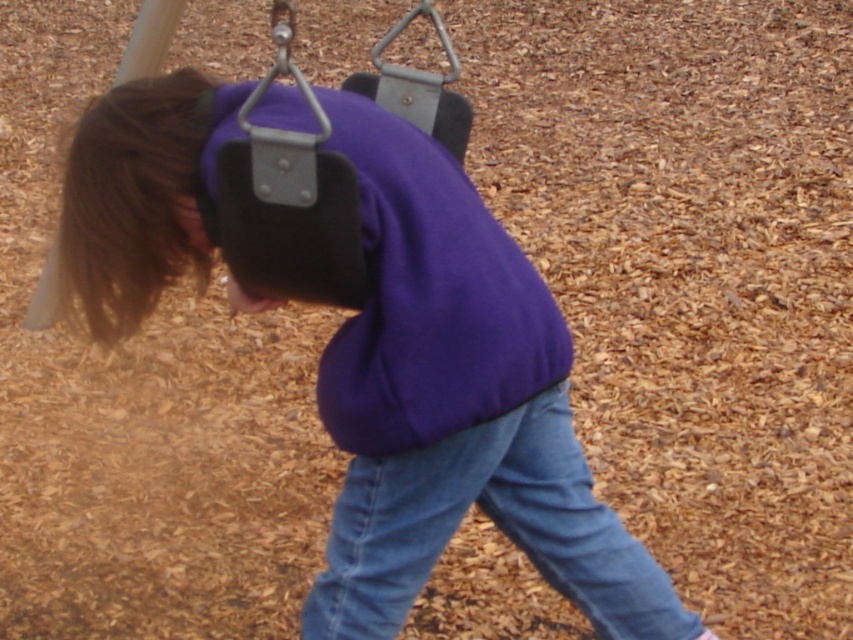
You are a photographer trying to capture the child on the swing without any distractions. Since the denim at lower center and metallic swing at center are both in the frame, which object should you focus on to ensure the child is the main subject?

The denim at lower center is in front of the metallic swing at center, so focusing on the metallic swing at center would place the child in the background and make them the main subject while the denim remains in front but not distracting.